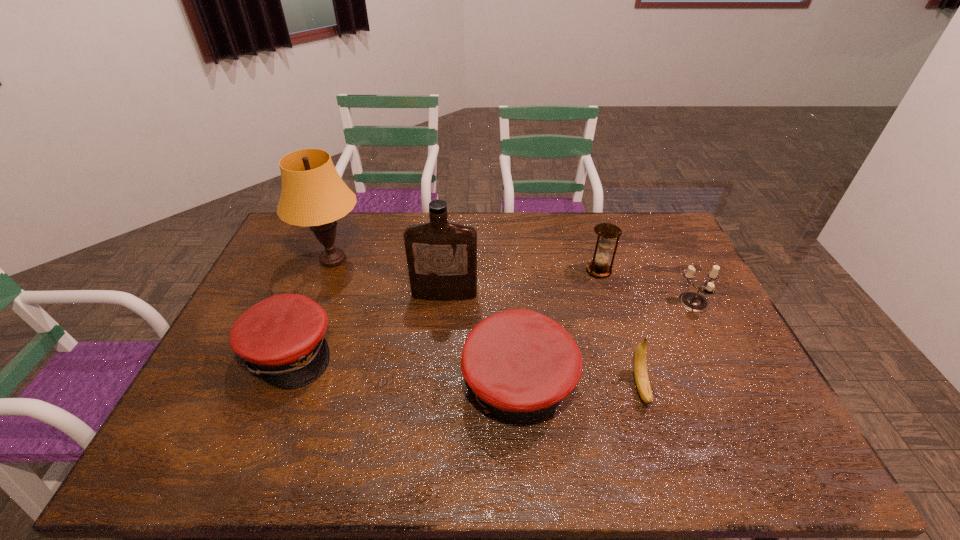
Where is `the left cap`? This screenshot has height=540, width=960. the left cap is located at coordinates (282, 338).

At what (x,y) coordinates should I click in order to perform the action: click on the right cap. Please return your answer as a coordinate pair (x, y). Looking at the image, I should click on (520, 364).

Locate an element on the screen. Image resolution: width=960 pixels, height=540 pixels. the fifth shortest object is located at coordinates (607, 232).

I want to click on lampshade, so click(x=313, y=194).

Where is `candle holder`? Image resolution: width=960 pixels, height=540 pixels. candle holder is located at coordinates (692, 301).

At what (x,y) coordinates should I click in order to perform the action: click on liquor. Please return your answer as a coordinate pair (x, y). This screenshot has width=960, height=540. Looking at the image, I should click on (441, 256).

Locate an element on the screen. This screenshot has width=960, height=540. banana is located at coordinates (642, 382).

You are a GUI agent. You are given a task and a screenshot of the screen. Output one action in this format:
    pyautogui.click(x=<x>, y=<y>)
    Task: Click on the free location located 0.290m on the front-facing side of the shorter cap
    
    Given the screenshot: What is the action you would take?
    pyautogui.click(x=437, y=352)

The width and height of the screenshot is (960, 540). Find the location of `vacant region located 0.380m on the front-facing side of the right cap`. vacant region located 0.380m on the front-facing side of the right cap is located at coordinates (317, 384).

At what (x,y) coordinates should I click in order to perform the action: click on free region located on the front-facing side of the right cap. Please return your answer as a coordinate pair (x, y). The width and height of the screenshot is (960, 540). Looking at the image, I should click on (416, 384).